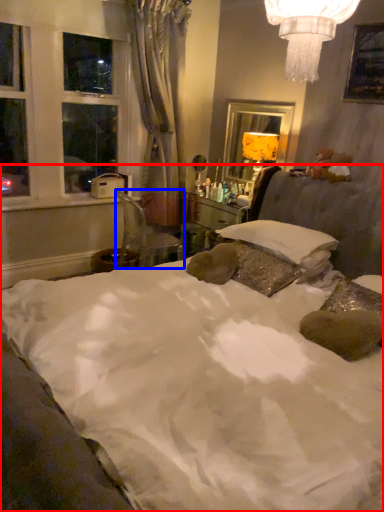
Question: Which point is closer to the camera, bed (highlighted by a red box) or chair (highlighted by a blue box)?

Choices:
 (A) bed
 (B) chair

Answer: (A)